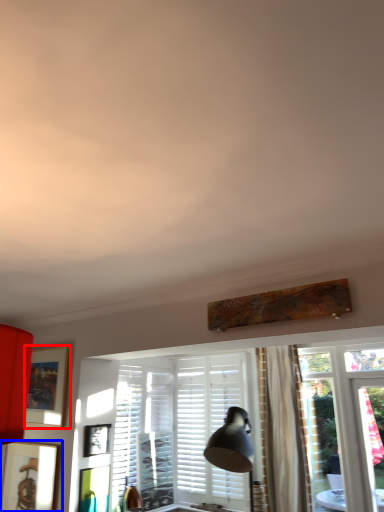
Question: Which object appears closest to the camera in this image, picture frame (highlighted by a red box) or picture frame (highlighted by a blue box)?

Choices:
 (A) picture frame
 (B) picture frame

Answer: (B)